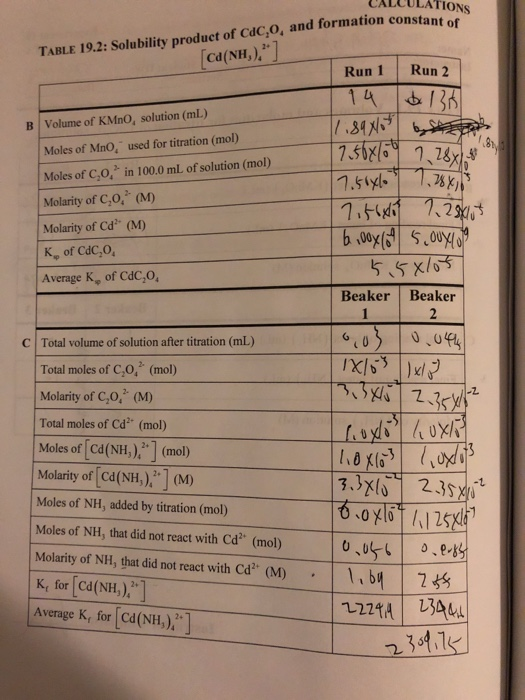
At what (x,y) coordinates should I click in order to perform the action: click on table. Please return your answer as a coordinate pair (x, y). This screenshot has height=700, width=525. Looking at the image, I should click on (167, 185), (201, 519).